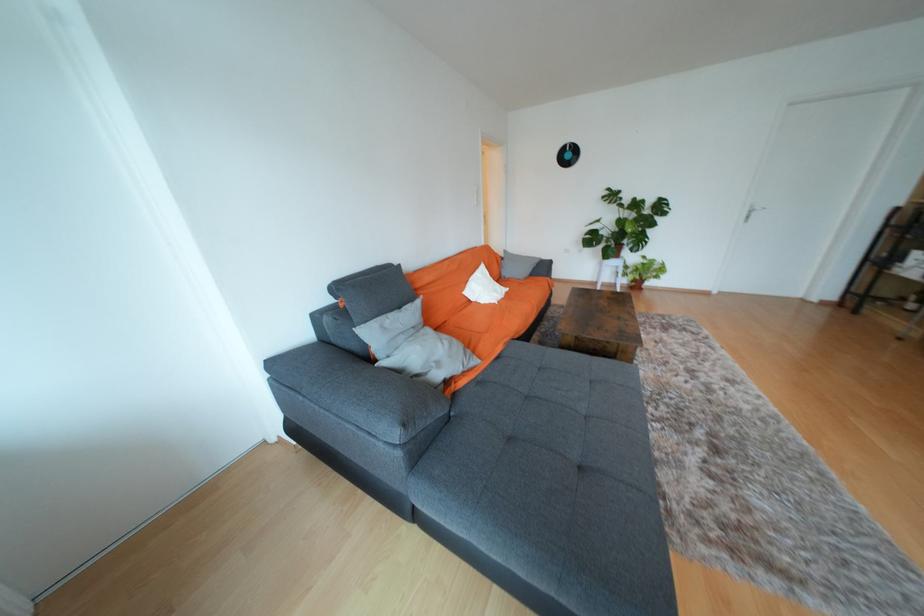
The image size is (924, 616). What do you see at coordinates (752, 211) in the screenshot? I see `a silver door handle` at bounding box center [752, 211].